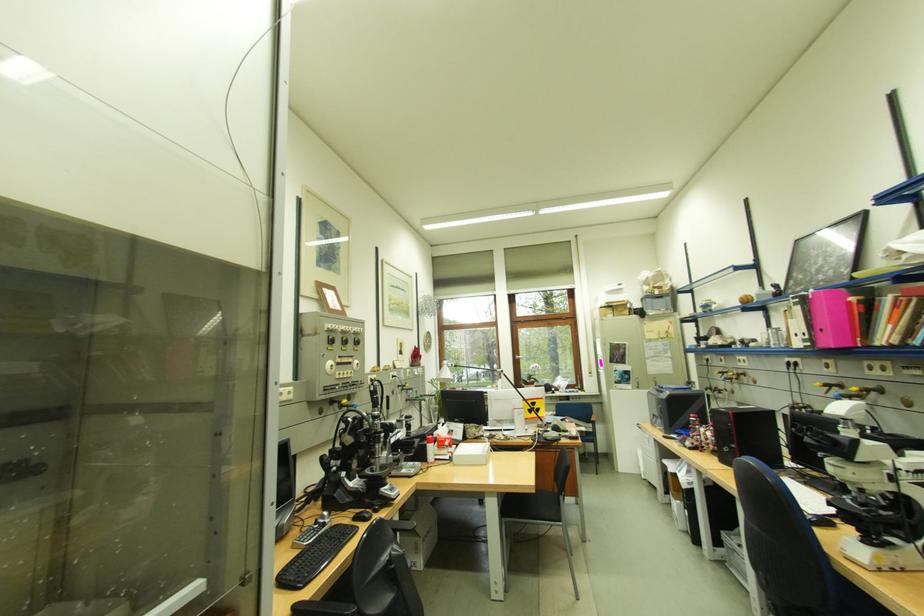
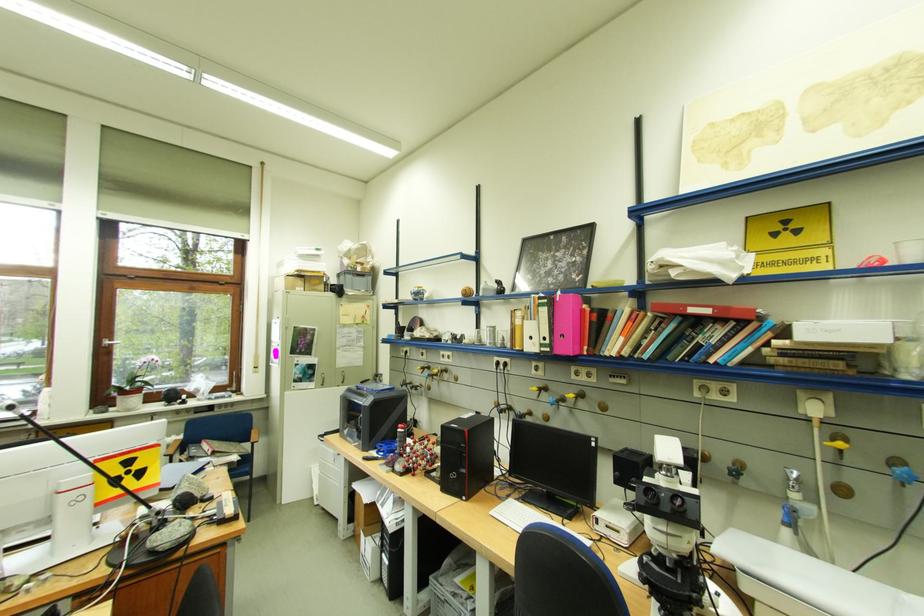
Find the pixel in the second image that matches the point at 820,345 in the first image.

(558, 351)